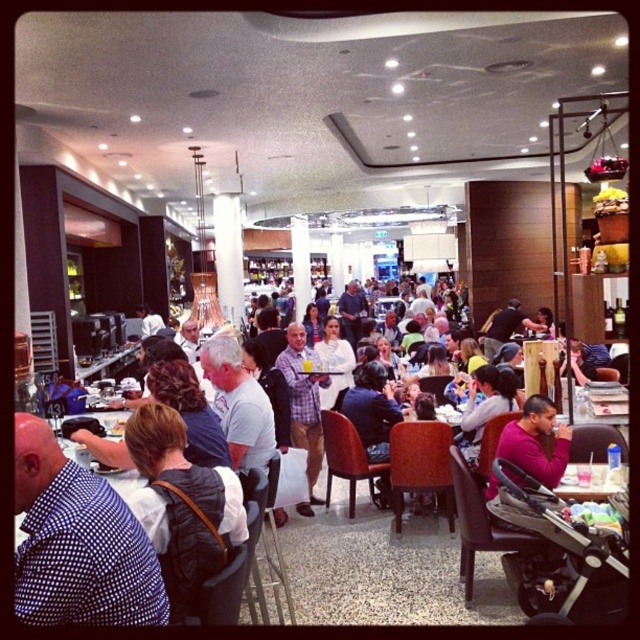
Which is more to the left, purple sweater at center or plaid shirt at center?

Positioned to the left is plaid shirt at center.

Image resolution: width=640 pixels, height=640 pixels. Identify the location of purple sweater at center. (536, 442).

Who is more distant from viewer, (141,540) or (317,406)?

The point (317,406) is behind.

From the picture: Can you confirm if blue checkered shirt at lower left is positioned to the right of plaid shirt at center?

No, blue checkered shirt at lower left is not to the right of plaid shirt at center.

Identify the location of blue checkered shirt at lower left. The image size is (640, 640). (77, 541).

Who is taller, blue checkered shirt at lower left or purple sweater at center?

Standing taller between the two is purple sweater at center.

Is blue checkered shirt at lower left positioned in front of purple sweater at center?

Yes.

This screenshot has width=640, height=640. Identify the location of blue checkered shirt at lower left. (77, 541).

This screenshot has height=640, width=640. What are the coordinates of `blue checkered shirt at lower left` in the screenshot? It's located at (77, 541).